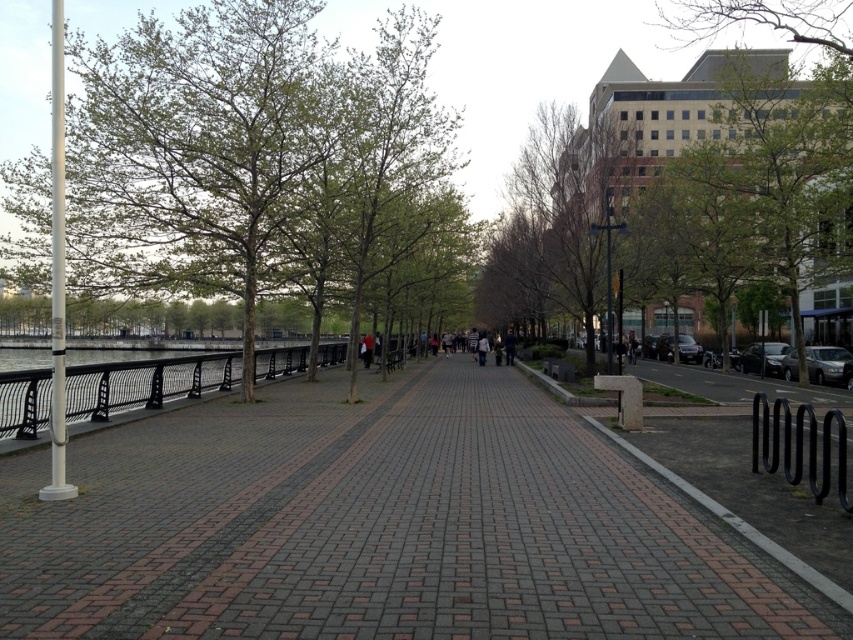
Between clear glass water at left and metallic silver sedan at right, which one has less height?

With less height is metallic silver sedan at right.

Is point (219, 368) positioned behind point (834, 376)?

No.

In order to click on clear glass water at left in this screenshot , I will do `click(144, 381)`.

Looking at this image, between brick paved walkway at center and clear glass water at left, which one appears on the left side from the viewer's perspective?

From the viewer's perspective, clear glass water at left appears more on the left side.

Between point (224, 522) and point (270, 355), which one is positioned behind?

Point (270, 355)

At what (x,y) coordinates should I click in order to perform the action: click on brick paved walkway at center. Please return your answer as a coordinate pair (x, y). Image resolution: width=853 pixels, height=640 pixels. Looking at the image, I should click on (378, 528).

Is green leafy tree at left thinner than clear glass water at left?

Incorrect, green leafy tree at left's width is not less than clear glass water at left's.

Is green leafy tree at left taller than clear glass water at left?

Correct, green leafy tree at left is much taller as clear glass water at left.

Which is in front, point (445, 109) or point (268, 355)?

Point (268, 355)

Identify the location of green leafy tree at left. The image size is (853, 640). (248, 150).